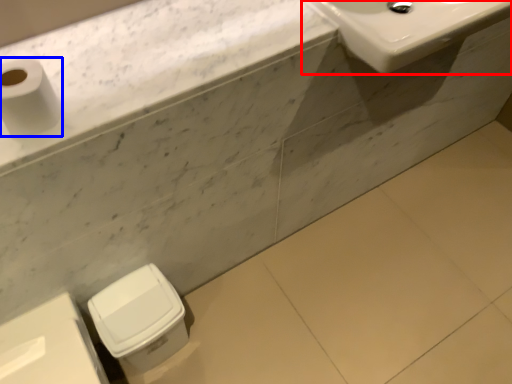
Question: Which point is further to the camera, sink (highlighted by a red box) or toilet paper (highlighted by a blue box)?

Choices:
 (A) sink
 (B) toilet paper

Answer: (A)